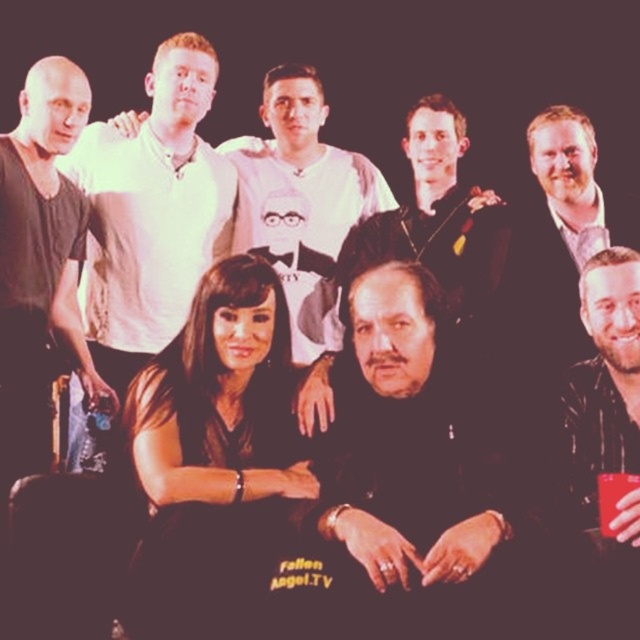
You are organizing a photo shoot and need to arrange participants based on their shirt sizes. If you have two participants wearing white shirts, one labeled as matte white shirt at upper left and the other as white matte shirt at upper center, which participant should you place first in a size order from smallest to largest?

The matte white shirt at upper left is smaller than the white matte shirt at upper center, so you should place the matte white shirt at upper left first in the size order from smallest to largest.

You are organizing a photoshoot and need to ensure that the black matte jacket at center and the matte black shirt at center are visible in the final image. Given their sizes, which one might require more careful framing to avoid being obscured by other elements?

The black matte jacket at center has a lesser width compared to the matte black shirt at center, so it might require more careful framing to avoid being obscured by other elements due to its smaller size.